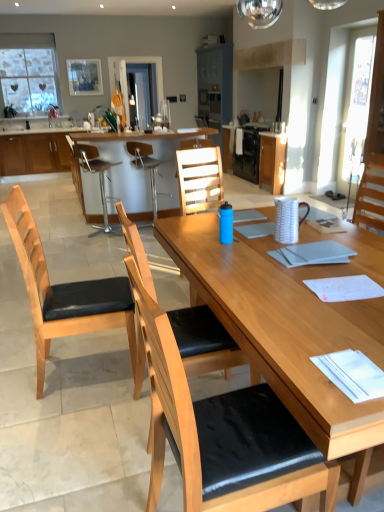
The width and height of the screenshot is (384, 512). Describe the element at coordinates (203, 341) in the screenshot. I see `wooden chair with black cushion at center, marked as the fourth chair in a back-to-front arrangement` at that location.

Measure the distance between wooden chair with black cushion at center, which is the fifth chair in back-to-front order, and camera.

A distance of 38.48 inches exists between wooden chair with black cushion at center, which is the fifth chair in back-to-front order, and camera.

Find the location of a particular element. The image size is (384, 512). wooden cabinet at center, marked as the first cabinetry in a right-to-left arrangement is located at coordinates (272, 161).

Where is `wooden table at center`? The width and height of the screenshot is (384, 512). wooden table at center is located at coordinates (142, 170).

Identify the location of table that appears above the light brown wood chair at center, placed as the 5th chair when sorted from front to back (from a real-world perspective). The image size is (384, 512). (142, 170).

Considering the positions of objects light brown wood chair at center, the 1th chair when ordered from back to front, and wooden table at center in the image provided, who is in front, light brown wood chair at center, the 1th chair when ordered from back to front, or wooden table at center?

light brown wood chair at center, the 1th chair when ordered from back to front, is closer to the camera.

From the image's perspective, who appears lower, light brown wood chair at center, the 1th chair when ordered from back to front, or wooden table at center?

light brown wood chair at center, the 1th chair when ordered from back to front.

Which object is thinner, light brown wood chair at center, the 1th chair when ordered from back to front, or wooden table at center?

light brown wood chair at center, the 1th chair when ordered from back to front.

Is wooden chair with black cushion at center, the first chair in the front-to-back sequence, closer to camera compared to brown leather bar stool at center, positioned as the fourth chair in front-to-back order?

Yes, the depth of wooden chair with black cushion at center, the first chair in the front-to-back sequence, is less than that of brown leather bar stool at center, positioned as the fourth chair in front-to-back order.

Considering the sizes of objects wooden chair with black cushion at center, which is the fifth chair in back-to-front order, and brown leather bar stool at center, positioned as the fourth chair in front-to-back order, in the image provided, who is taller, wooden chair with black cushion at center, which is the fifth chair in back-to-front order, or brown leather bar stool at center, positioned as the fourth chair in front-to-back order,?

Standing taller between the two is wooden chair with black cushion at center, which is the fifth chair in back-to-front order.

From a real-world perspective, count 3rd chairs upward from the brown leather bar stool at center, the 2th chair when ordered from back to front, and point to it. Please provide its 2D coordinates.

[(224, 433)]

Can you confirm if wooden chair with black cushion at center, the first chair in the front-to-back sequence, is positioned to the right of brown leather bar stool at center, the 2th chair when ordered from back to front?

Yes.

In terms of height, does wooden chair with black cushion at center, which is counted as the 2th chair, starting from the front, look taller or shorter compared to wooden table at center?

In the image, wooden chair with black cushion at center, which is counted as the 2th chair, starting from the front, appears to be taller than wooden table at center.

Does wooden chair with black cushion at center, marked as the fourth chair in a back-to-front arrangement, come behind wooden table at center?

No, the depth of wooden chair with black cushion at center, marked as the fourth chair in a back-to-front arrangement, is less than that of wooden table at center.

From a real-world perspective, is wooden table at center physically located above or below wooden cabinet at left, which is the 3th cabinetry from right to left?

From a real-world perspective, wooden table at center is physically above wooden cabinet at left, which is the 3th cabinetry from right to left.

In terms of size, does wooden table at center appear bigger or smaller than wooden cabinet at left, which is the 3th cabinetry from right to left?

Considering their sizes, wooden table at center takes up more space than wooden cabinet at left, which is the 3th cabinetry from right to left.

Can you tell me how much wooden table at center and wooden cabinet at left, placed as the 1th cabinetry when sorted from left to right, differ in facing direction?

180 degrees separate the facing orientations of wooden table at center and wooden cabinet at left, placed as the 1th cabinetry when sorted from left to right.

Relative to wooden cabinet at left, placed as the 1th cabinetry when sorted from left to right, is wooden table at center in front or behind?

In the image, wooden table at center appears in front of wooden cabinet at left, placed as the 1th cabinetry when sorted from left to right.

From the image's perspective, between glass heart-patterned window at upper left and wooden cabinet at center, marked as the first cabinetry in a right-to-left arrangement, which one is located above?

glass heart-patterned window at upper left, from the image's perspective.

Is point (47, 61) positioned before point (271, 163)?

No.

Looking at this image, from a real-world perspective, is glass heart-patterned window at upper left physically located above or below wooden cabinet at center, marked as the first cabinetry in a right-to-left arrangement?

Clearly, from a real-world perspective, glass heart-patterned window at upper left is above wooden cabinet at center, marked as the first cabinetry in a right-to-left arrangement.

How many degrees apart are the facing directions of glass heart-patterned window at upper left and wooden cabinet at center, marked as the first cabinetry in a right-to-left arrangement?

glass heart-patterned window at upper left and wooden cabinet at center, marked as the first cabinetry in a right-to-left arrangement, are facing 90.2 degrees away from each other.

Can you confirm if wooden chair with black cushion at center, marked as the fourth chair in a back-to-front arrangement, is smaller than brown leather bar stool at center, the 2th chair when ordered from back to front?

Indeed, wooden chair with black cushion at center, marked as the fourth chair in a back-to-front arrangement, has a smaller size compared to brown leather bar stool at center, the 2th chair when ordered from back to front.

From a real-world perspective, is wooden chair with black cushion at center, marked as the fourth chair in a back-to-front arrangement, above or below brown leather bar stool at center, positioned as the fourth chair in front-to-back order?

wooden chair with black cushion at center, marked as the fourth chair in a back-to-front arrangement, is situated higher than brown leather bar stool at center, positioned as the fourth chair in front-to-back order, in the real world.

Which of these two, wooden chair with black cushion at center, marked as the fourth chair in a back-to-front arrangement, or brown leather bar stool at center, the 2th chair when ordered from back to front, is thinner?

Thinner between the two is brown leather bar stool at center, the 2th chair when ordered from back to front.

Is transparent glass door at center located within wooden chair with black cushion at center, marked as the fourth chair in a back-to-front arrangement?

No, transparent glass door at center is not inside wooden chair with black cushion at center, marked as the fourth chair in a back-to-front arrangement.

Is wooden chair with black cushion at center, marked as the fourth chair in a back-to-front arrangement, taller or shorter than transparent glass door at center?

Considering their sizes, wooden chair with black cushion at center, marked as the fourth chair in a back-to-front arrangement, has more height than transparent glass door at center.

Based on their positions, is wooden chair with black cushion at center, which is counted as the 2th chair, starting from the front, located to the left or right of transparent glass door at center?

wooden chair with black cushion at center, which is counted as the 2th chair, starting from the front, is positioned on transparent glass door at center's right side.

Starting from the wooden table at center, which chair is the 2nd one to the right? Please provide its 2D coordinates.

[(147, 166)]

This screenshot has height=512, width=384. In order to click on chair that is the 4th one when counting leftward from the wooden chair with black cushion at center, the first chair in the front-to-back sequence in this screenshot , I will do `click(91, 173)`.

Estimate the real-world distances between objects in this image. Which object is closer to light wood chair with black cushion at left, placed as the 3th chair when sorted from back to front, wooden chair with black cushion at center, which is the fifth chair in back-to-front order, or wooden cabinet at center, marked as the first cabinetry in a right-to-left arrangement?

Based on the image, wooden chair with black cushion at center, which is the fifth chair in back-to-front order, appears to be nearer to light wood chair with black cushion at left, placed as the 3th chair when sorted from back to front.

When comparing their distances from wooden cabinet at center, marked as the third cabinetry in a left-to-right arrangement, does light wood chair with black cushion at left, arranged as the third chair when viewed from the front, or glass heart-patterned window at upper left seem closer?

The object closer to wooden cabinet at center, marked as the third cabinetry in a left-to-right arrangement, is glass heart-patterned window at upper left.

Estimate the real-world distances between objects in this image. Which object is closer to wooden cabinet at left, which is the 3th cabinetry from right to left, transparent glass door at center or wooden cabinet at center, marked as the first cabinetry in a right-to-left arrangement?

The object closer to wooden cabinet at left, which is the 3th cabinetry from right to left, is transparent glass door at center.

Considering their positions, is wooden chair with black cushion at center, the first chair in the front-to-back sequence, positioned closer to transparent glass door at center than light wood chair with black cushion at left, placed as the 3th chair when sorted from back to front?

light wood chair with black cushion at left, placed as the 3th chair when sorted from back to front, is positioned closer to the anchor transparent glass door at center.

Which object lies nearer to the anchor point wooden chair with black cushion at center, which is counted as the 2th chair, starting from the front, wooden chair with black cushion at center, the first chair in the front-to-back sequence, or brown leather bar stool at center, the 2th chair when ordered from back to front?

wooden chair with black cushion at center, the first chair in the front-to-back sequence, is closer to wooden chair with black cushion at center, which is counted as the 2th chair, starting from the front.

In the scene shown: When comparing their distances from transparent glass door at center, does wooden cabinet at left, which is the 3th cabinetry from right to left, or white glossy sink at upper center seem further?

wooden cabinet at left, which is the 3th cabinetry from right to left, is further to transparent glass door at center.

Considering their positions, is matte wood cabinet at center, the second cabinetry viewed from the left, positioned closer to wooden chair with black cushion at center, which is counted as the 2th chair, starting from the front, than white glossy sink at upper center?

white glossy sink at upper center.

Considering their positions, is brown leather bar stool at center, the 2th chair when ordered from back to front, positioned closer to glass heart-patterned window at upper left than wooden table at center?

Based on the image, wooden table at center appears to be nearer to glass heart-patterned window at upper left.

Locate an element on the screen. table between wooden chair with black cushion at center, the first chair in the front-to-back sequence, and wooden cabinet at left, which is the 3th cabinetry from right to left, along the z-axis is located at coordinates (142, 170).

Where is `sink between wooden cabinet at left, placed as the 1th cabinetry when sorted from left to right, and matte wood cabinet at center, arranged as the second cabinetry when viewed from the right, from left to right`? The height and width of the screenshot is (512, 384). sink between wooden cabinet at left, placed as the 1th cabinetry when sorted from left to right, and matte wood cabinet at center, arranged as the second cabinetry when viewed from the right, from left to right is located at coordinates pos(37,125).

You are a GUI agent. You are given a task and a screenshot of the screen. Output one action in this format:
    pyautogui.click(x=<x>, y=<y>)
    Task: Click on the sink that lies between glass heart-patterned window at upper left and wooden cabinet at left, placed as the 1th cabinetry when sorted from left to right, from top to bottom
    This screenshot has width=384, height=512.
    Given the screenshot: What is the action you would take?
    pyautogui.click(x=37, y=125)

The width and height of the screenshot is (384, 512). Find the location of `sink between light brown wood chair at center, placed as the 5th chair when sorted from front to back, and wooden cabinet at left, which is the 3th cabinetry from right to left, from front to back`. sink between light brown wood chair at center, placed as the 5th chair when sorted from front to back, and wooden cabinet at left, which is the 3th cabinetry from right to left, from front to back is located at coordinates pos(37,125).